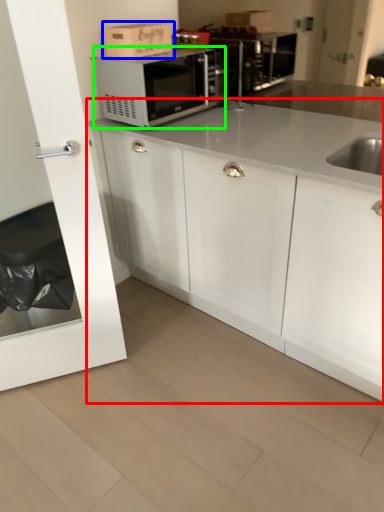
Question: Which is nearer to the cabinetry (highlighted by a red box)? cardboard box (highlighted by a blue box) or microwave oven (highlighted by a green box).

Choices:
 (A) cardboard box
 (B) microwave oven

Answer: (B)